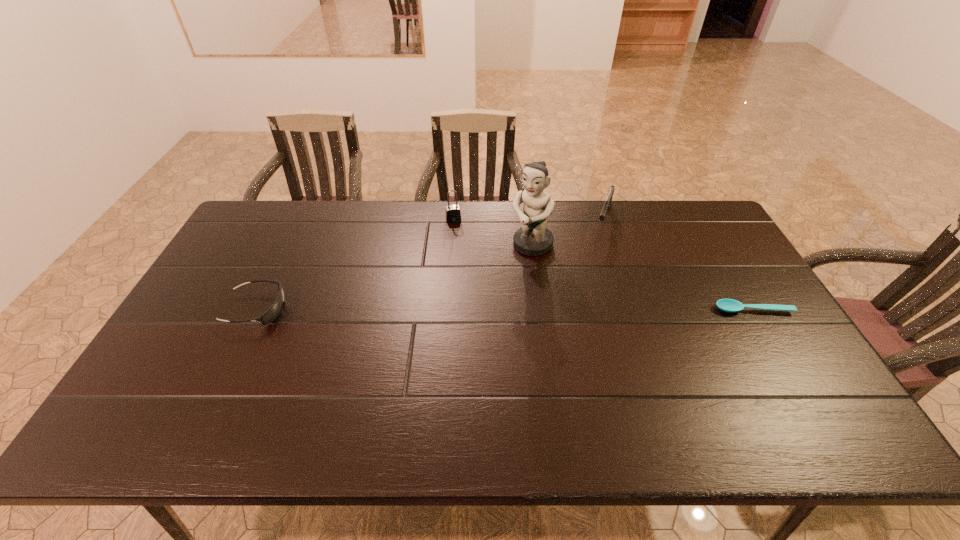
This screenshot has height=540, width=960. What are the coordinates of `free space on the desktop that is between the second shortest object and the shortest object and is positioned on the front-facing side of the tallest object` in the screenshot? It's located at (469, 309).

Identify the location of free space on the desktop that is between the leftmost object and the rightmost object and is positioned on the shackle of the second tallest object. (474, 309).

Where is `vacant space on the desktop that is between the leftmost object and the spoon and is positioned at the muzzle end of the second object from right to left`? vacant space on the desktop that is between the leftmost object and the spoon and is positioned at the muzzle end of the second object from right to left is located at coordinates (572, 309).